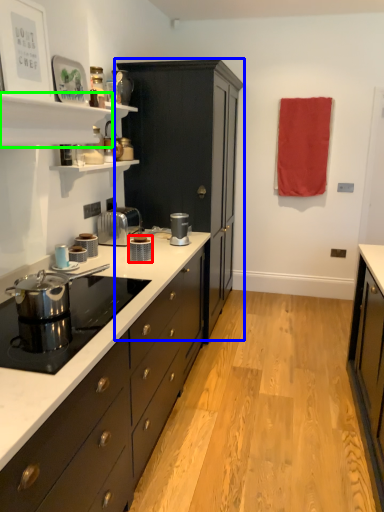
Question: Which object is the farthest from kitchen appliance (highlighted by a red box)? Choose among these: cabinetry (highlighted by a blue box) or shelf (highlighted by a green box).

Choices:
 (A) cabinetry
 (B) shelf

Answer: (A)